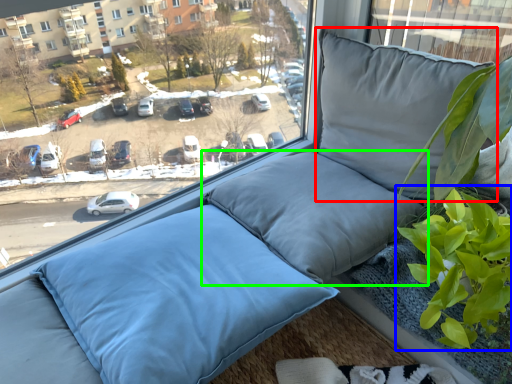
Question: Which object is the farthest from pillow (highlighted by a red box)? Choose among these: vegetation (highlighted by a blue box) or pillow (highlighted by a green box).

Choices:
 (A) vegetation
 (B) pillow

Answer: (A)